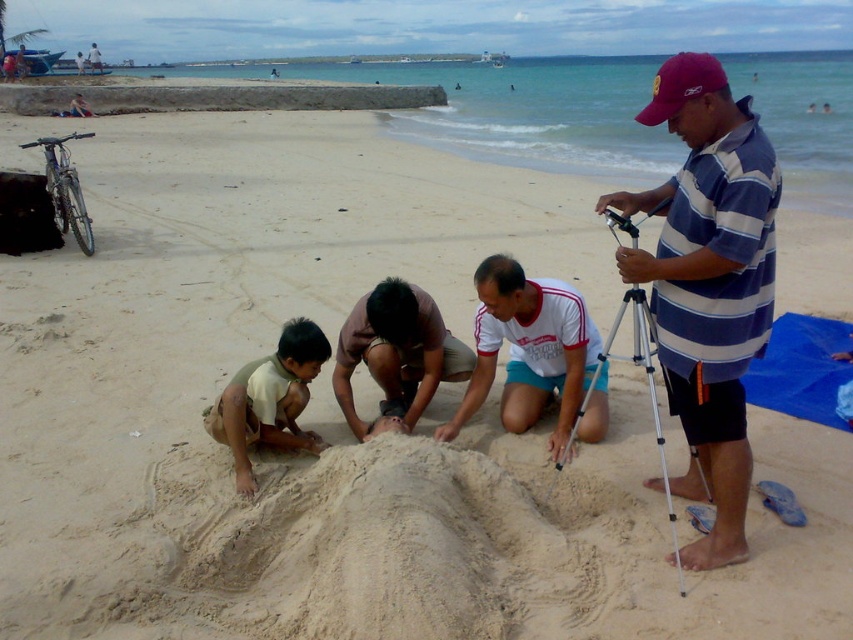
Question: Which point is farther to the camera?

Choices:
 (A) silver metallic tripod at right
 (B) brown cotton shirt at center
 (C) striped cotton shirt at center

Answer: (B)

Question: Which point is closer to the camera?

Choices:
 (A) (712, 365)
 (B) (578, 316)

Answer: (A)

Question: Is white/red striped shirt at center wider than brown cotton shirt at center?

Choices:
 (A) yes
 (B) no

Answer: (A)

Question: Is white/red striped shirt at center positioned at the back of brown cotton shirt at center?

Choices:
 (A) yes
 (B) no

Answer: (B)

Question: Can you confirm if brown cotton shirt at center is smaller than red fabric cap at upper center?

Choices:
 (A) no
 (B) yes

Answer: (B)

Question: Which object is the farthest from the brown cotton shirt at center?

Choices:
 (A) white/red striped shirt at center
 (B) red fabric cap at upper center
 (C) striped cotton shirt at center

Answer: (B)